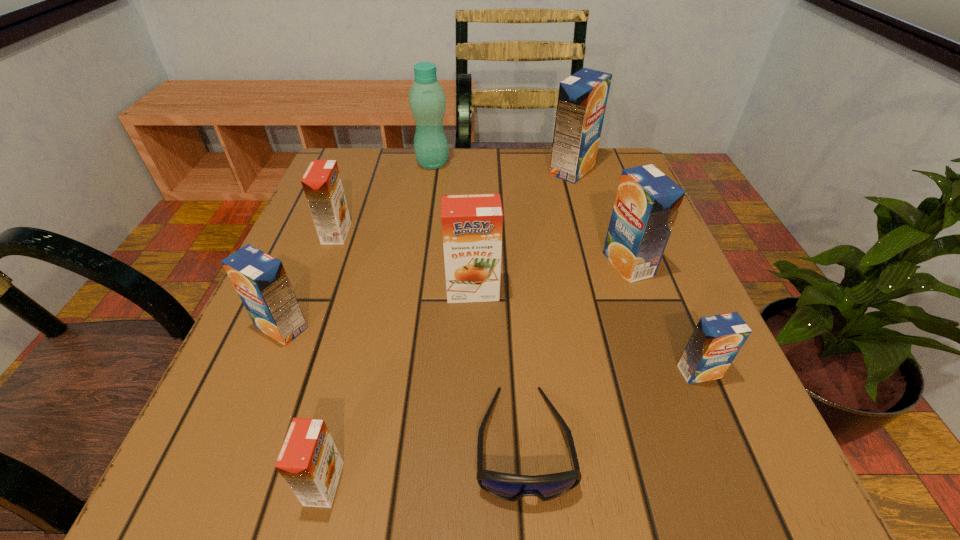
At what (x,y) coordinates should I click in order to perform the action: click on bottle. Please return your answer as a coordinate pair (x, y). The height and width of the screenshot is (540, 960). Looking at the image, I should click on (427, 100).

This screenshot has height=540, width=960. I want to click on the tallest orange juice, so click(x=582, y=99).

This screenshot has height=540, width=960. In order to click on the farthest blue orange_juice in this screenshot , I will do `click(582, 99)`.

Locate an element on the screen. The image size is (960, 540). the second farthest orange orange juice is located at coordinates (472, 224).

I want to click on the rightmost orange orange juice, so click(x=472, y=224).

At what (x,y) coordinates should I click in order to perform the action: click on the third smallest blue orange_juice. Please return your answer as a coordinate pair (x, y). The height and width of the screenshot is (540, 960). Looking at the image, I should click on (647, 202).

Where is `the second smallest blue orange_juice`? The width and height of the screenshot is (960, 540). the second smallest blue orange_juice is located at coordinates (260, 280).

Where is `the third nearest orange juice`? the third nearest orange juice is located at coordinates (260, 280).

Locate an element on the screen. the second smallest orange orange juice is located at coordinates [322, 185].

At what (x,y) coordinates should I click in order to perform the action: click on the second farthest orange juice. Please return your answer as a coordinate pair (x, y). Looking at the image, I should click on (322, 185).